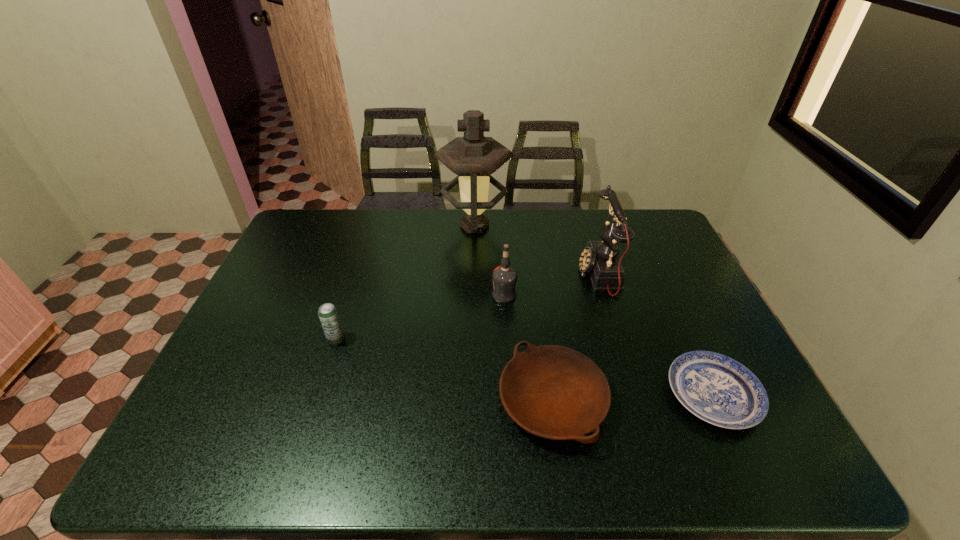
This screenshot has width=960, height=540. Identify the location of the shortest object. (719, 390).

Locate an element on the screen. This screenshot has height=540, width=960. blank area located on the right of the farthest object is located at coordinates (x=539, y=226).

The image size is (960, 540). Identify the location of vacant space located on the dial of the second object from right to left. (551, 275).

At what (x,y) coordinates should I click in order to perform the action: click on vacant space situated 0.300m on the dial of the second object from right to left. Please return your answer as a coordinate pair (x, y). Looking at the image, I should click on [484, 275].

At what (x,y) coordinates should I click in order to perform the action: click on vacant space situated 0.300m on the dial of the second object from right to left. Please return your answer as a coordinate pair (x, y). Looking at the image, I should click on 484,275.

Where is `vacant point located on the front label of the third tallest object`? This screenshot has height=540, width=960. vacant point located on the front label of the third tallest object is located at coordinates (380, 295).

The image size is (960, 540). Identify the location of free spot located 0.260m on the front label of the third tallest object. (404, 295).

This screenshot has height=540, width=960. I want to click on free space located 0.200m on the front label of the third tallest object, so point(424,295).

Locate an element on the screen. This screenshot has width=960, height=540. vacant space located on the front of the beer can is located at coordinates (317, 398).

You are a GUI agent. You are given a task and a screenshot of the screen. Output one action in this format:
    pyautogui.click(x=<x>, y=<y>)
    Task: Click on the vacant position located on the left of the left plate
    
    Given the screenshot: What is the action you would take?
    pyautogui.click(x=333, y=401)